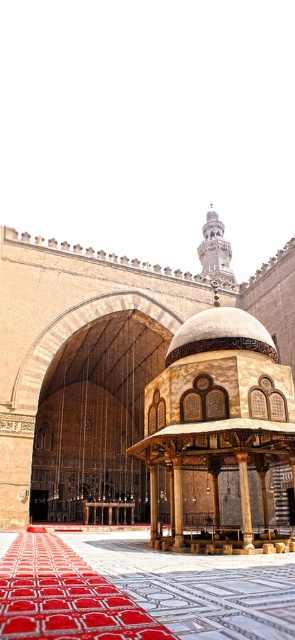
Is gold textured dome at center shorter than polished wood pillar at center?

Indeed, gold textured dome at center has a lesser height compared to polished wood pillar at center.

Locate an element on the screen. gold textured dome at center is located at coordinates [220, 333].

Between gold textured dome at center and brown polished wood pillar at center, which one has more height?

Standing taller between the two is brown polished wood pillar at center.

Locate an element on the screen. This screenshot has height=640, width=295. gold textured dome at center is located at coordinates (220, 333).

The width and height of the screenshot is (295, 640). What do you see at coordinates (220, 333) in the screenshot?
I see `gold textured dome at center` at bounding box center [220, 333].

This screenshot has height=640, width=295. I want to click on gold textured dome at center, so click(x=220, y=333).

In the scene shown: Is red carpet at center further to the viewer compared to polished wood pillar at center?

No, red carpet at center is closer to the viewer.

Is point (128, 614) behind point (156, 524)?

That is False.

This screenshot has width=295, height=640. I want to click on red carpet at center, so click(x=64, y=596).